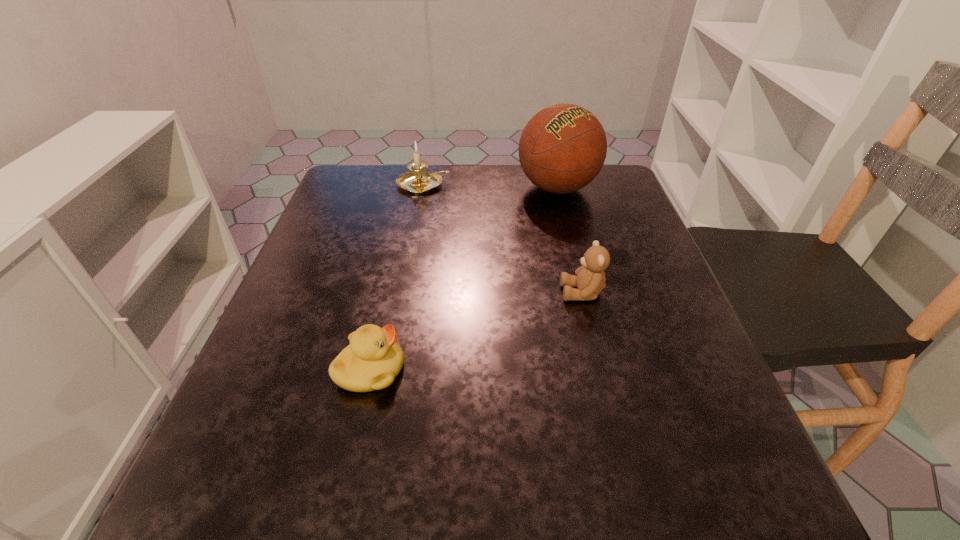
The image size is (960, 540). I want to click on free location at the near edge, so click(x=564, y=513).

What are the coordinates of `vacant space at the left edge of the desktop` in the screenshot? It's located at (254, 355).

This screenshot has height=540, width=960. In order to click on vacant area at the right edge in this screenshot , I will do `click(614, 245)`.

Locate an element on the screen. free space at the far right corner of the desktop is located at coordinates (611, 165).

The image size is (960, 540). Find the location of `vacant space at the near right corner`. vacant space at the near right corner is located at coordinates (659, 495).

At what (x,y) coordinates should I click in order to perform the action: click on empty location between the third farthest object and the candle holder. Please return your answer as a coordinate pair (x, y). Looking at the image, I should click on (503, 239).

The height and width of the screenshot is (540, 960). I want to click on free space between the tallest object and the candle holder, so click(x=491, y=186).

Image resolution: width=960 pixels, height=540 pixels. In order to click on free spot between the nearest object and the candle holder in this screenshot , I will do `click(397, 277)`.

Where is `vacant space that is in between the shortest object and the second nearest object`? The width and height of the screenshot is (960, 540). vacant space that is in between the shortest object and the second nearest object is located at coordinates (476, 331).

Locate an element on the screen. The height and width of the screenshot is (540, 960). vacant space that's between the duckling and the basketball is located at coordinates (464, 279).